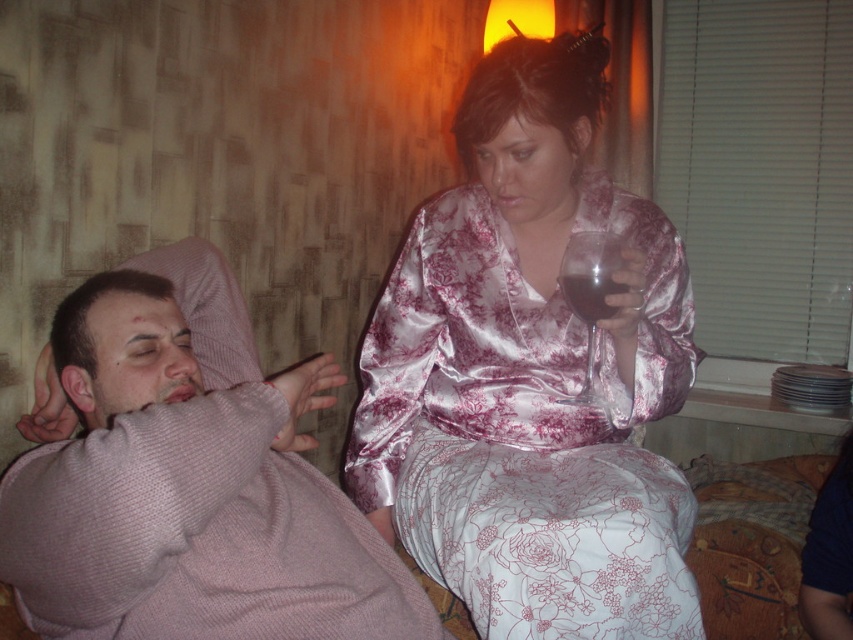
You are a photographer aiming to capture a closeup of the transparent glass at upper center without including the pink knitted sweater at left in the frame. Based on their positions, is this possible?

The pink knitted sweater at left is to the left of transparent glass at upper center, so if you position the camera to the right side of the transparent glass at upper center, you can capture it without including the pink knitted sweater at left.

You are a photographer setting up for a portrait. You need to position a spotlight so that it illuminates both the pink knitted sweater at left and the dark glass at upper center without casting shadows on the window. Given their positions, where should you place the spotlight relative to these objects?

The pink knitted sweater at left is to the left of dark glass at upper center. To avoid casting shadows on the window, the spotlight should be placed to the right of the dark glass at upper center, ensuring light reaches both objects while avoiding the window area.

You need to determine which object is larger between the pink knitted sweater at left and the transparent glass at upper center. Which one is bigger?

The pink knitted sweater at left is bigger than the transparent glass at upper center according to the description.